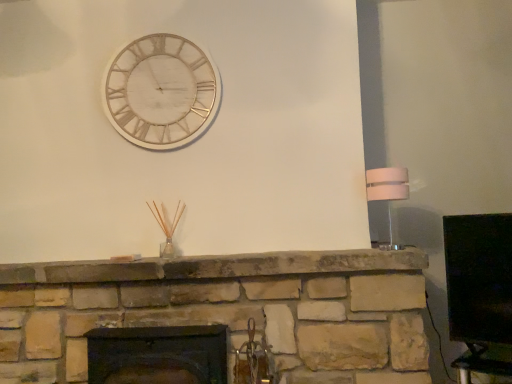
The width and height of the screenshot is (512, 384). Describe the element at coordinates (161, 92) in the screenshot. I see `white marble clock at upper center` at that location.

Identify the location of white marble clock at upper center. The image size is (512, 384). (161, 92).

Which is in front, white glossy lampshade at right or white marble clock at upper center?

white glossy lampshade at right is closer to the camera.

Would you say white glossy lampshade at right is inside or outside white marble clock at upper center?

white glossy lampshade at right is spatially situated outside white marble clock at upper center.

Is white glossy lampshade at right positioned far away from white marble clock at upper center?

Indeed, white glossy lampshade at right is not near white marble clock at upper center.

Image resolution: width=512 pixels, height=384 pixels. Identify the location of lamp that is below the white marble clock at upper center (from the image's perspective). (387, 198).

From a real-world perspective, is white marble clock at upper center over white glossy lampshade at right?

Yes, from a real-world perspective, white marble clock at upper center is on top of white glossy lampshade at right.

From the image's perspective, between white marble clock at upper center and white glossy lampshade at right, who is located below?

white glossy lampshade at right.

This screenshot has height=384, width=512. In the image, there is a white marble clock at upper center. Identify the location of lamp below it (from a real-world perspective). (387, 198).

From the image's perspective, is white marble clock at upper center above dark brown wood fireplace at center?

Yes, from the image's perspective, white marble clock at upper center is above dark brown wood fireplace at center.

Considering the relative sizes of white marble clock at upper center and dark brown wood fireplace at center in the image provided, is white marble clock at upper center smaller than dark brown wood fireplace at center?

Indeed, white marble clock at upper center has a smaller size compared to dark brown wood fireplace at center.

In terms of width, does white marble clock at upper center look wider or thinner when compared to dark brown wood fireplace at center?

white marble clock at upper center is thinner than dark brown wood fireplace at center.

Locate an element on the screen. fireplace that appears below the white marble clock at upper center (from a real-world perspective) is located at coordinates (158, 355).

Which point is more distant from viewer, (144,372) or (403,173)?

The point (403,173) is farther.

Are dark brown wood fireplace at center and white glossy lampshade at right making contact?

There is a gap between dark brown wood fireplace at center and white glossy lampshade at right.

Where is `fireplace below the white glossy lampshade at right (from a real-world perspective)`? The height and width of the screenshot is (384, 512). fireplace below the white glossy lampshade at right (from a real-world perspective) is located at coordinates click(158, 355).

In order to click on fireplace located on the left of white glossy lampshade at right in this screenshot , I will do `click(158, 355)`.

From the image's perspective, which object appears higher, white glossy lampshade at right or dark brown wood fireplace at center?

white glossy lampshade at right, from the image's perspective.

Does point (390, 217) lie in front of point (213, 351)?

No, (390, 217) is behind (213, 351).

Which object is positioned more to the left, dark brown wood fireplace at center or white marble clock at upper center?

From the viewer's perspective, white marble clock at upper center appears more on the left side.

How distant is dark brown wood fireplace at center from white marble clock at upper center?

dark brown wood fireplace at center is 3.48 feet away from white marble clock at upper center.

Could you tell me if dark brown wood fireplace at center is facing white marble clock at upper center?

No, dark brown wood fireplace at center is not facing towards white marble clock at upper center.

From the image's perspective, which is below, dark brown wood fireplace at center or white marble clock at upper center?

dark brown wood fireplace at center is shown below in the image.

In the image, there is a white glossy lampshade at right. Find the location of `wall clock above it (from the image's perspective)`. wall clock above it (from the image's perspective) is located at coordinates (161, 92).

Locate an element on the screen. The width and height of the screenshot is (512, 384). lamp below the white marble clock at upper center (from a real-world perspective) is located at coordinates (387, 198).

From the image, which object appears to be farther from dark brown wood fireplace at center, white glossy lampshade at right or white marble clock at upper center?

white glossy lampshade at right lies further to dark brown wood fireplace at center than the other object.

From the image, which object appears to be nearer to white glossy lampshade at right, white marble clock at upper center or dark brown wood fireplace at center?

white marble clock at upper center.

Based on their spatial positions, is dark brown wood fireplace at center or white marble clock at upper center closer to white glossy lampshade at right?

white marble clock at upper center lies closer to white glossy lampshade at right than the other object.

From the image, which object appears to be farther from white marble clock at upper center, white glossy lampshade at right or dark brown wood fireplace at center?

white glossy lampshade at right lies further to white marble clock at upper center than the other object.

Which object lies further to the anchor point dark brown wood fireplace at center, white marble clock at upper center or white glossy lampshade at right?

Among the two, white glossy lampshade at right is located further to dark brown wood fireplace at center.

When comparing their distances from white marble clock at upper center, does dark brown wood fireplace at center or white glossy lampshade at right seem further?

white glossy lampshade at right is positioned further to the anchor white marble clock at upper center.

Where is `lamp between white marble clock at upper center and dark brown wood fireplace at center from top to bottom`? The image size is (512, 384). lamp between white marble clock at upper center and dark brown wood fireplace at center from top to bottom is located at coordinates (387, 198).